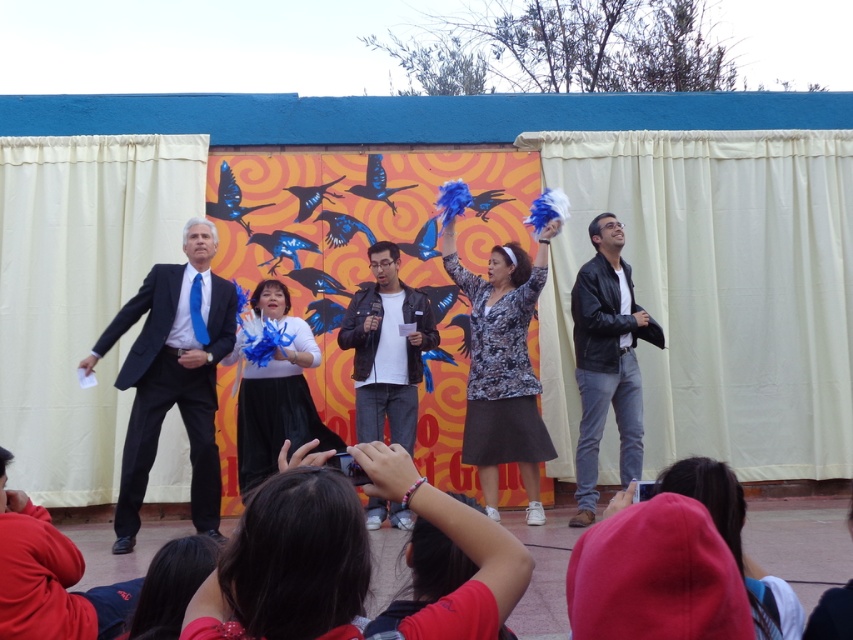
Is matte red shirt at lower center to the right of leather jacket at center from the viewer's perspective?

Indeed, matte red shirt at lower center is positioned on the right side of leather jacket at center.

Identify the location of matte red shirt at lower center. The image size is (853, 640). (799, 541).

Locate an element on the screen. The image size is (853, 640). matte red shirt at lower center is located at coordinates point(799,541).

Is matte black suit at left below black leather jacket at center?

Yes.

Is point (199, 378) farther from viewer compared to point (595, 349)?

No, it is not.

Find the location of a particular element. matte black suit at left is located at coordinates (172, 376).

Is matte black suit at left positioned behind matte red shirt at lower center?

No, it is not.

Which of these two, matte black suit at left or matte red shirt at lower center, stands taller?

matte black suit at left is taller.

Is point (105, 346) less distant than point (828, 499)?

Yes, point (105, 346) is in front of point (828, 499).

This screenshot has width=853, height=640. I want to click on matte black suit at left, so [x=172, y=376].